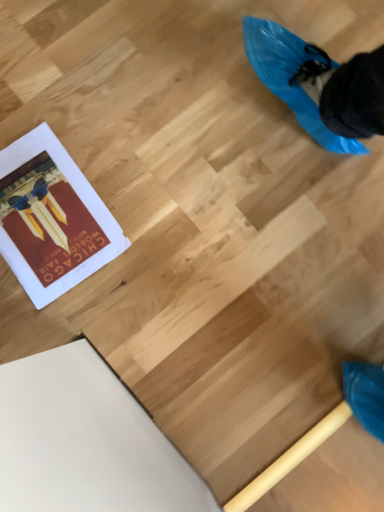
Identify the location of blank space situated above matte paper poster at lower left (from a real-world perspective). The image size is (384, 512). (48, 219).